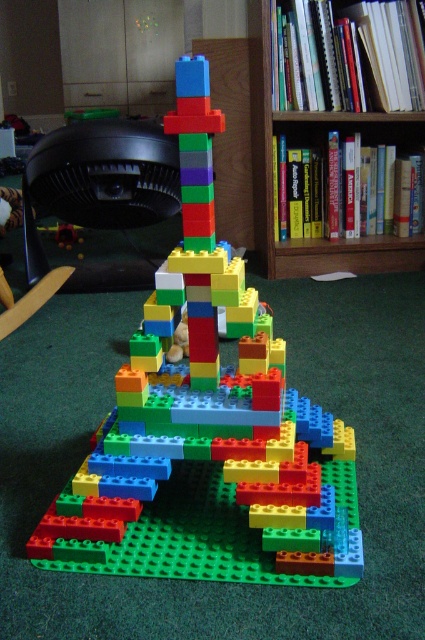
Consider the image. Can you confirm if multicolored plastic blocks at center is positioned to the right of wooden bookshelf at upper center?

No, multicolored plastic blocks at center is not to the right of wooden bookshelf at upper center.

Who is more distant from viewer, (87, 529) or (289, 248)?

The point (289, 248) is more distant.

At what (x,y) coordinates should I click in order to perform the action: click on multicolored plastic blocks at center. Please return your answer as a coordinate pair (x, y). Looking at the image, I should click on (209, 451).